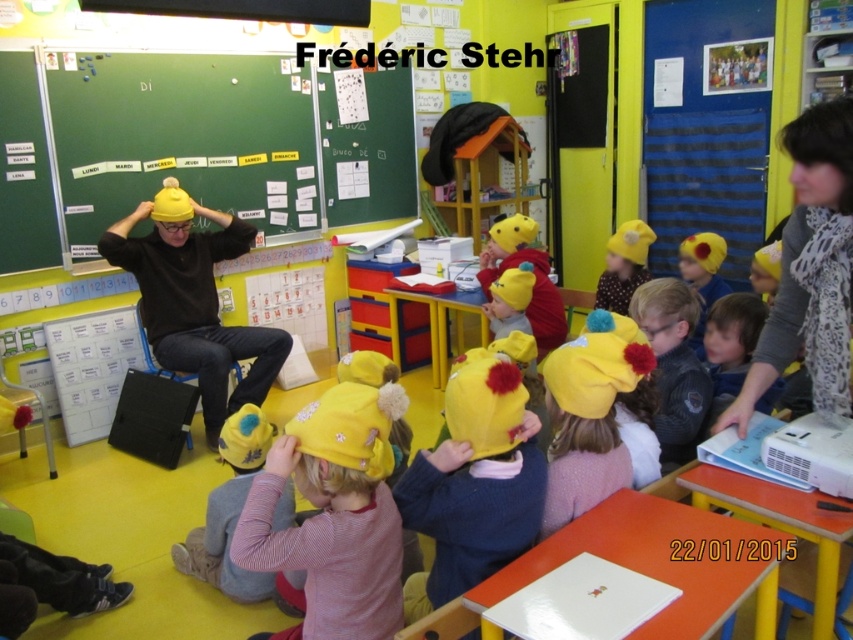
You are a photographer standing in the classroom. You want to take a closeup photo of the yellow fuzzy hat at lower center. The camera you are using has a minimum focusing distance of 1.5 meters. Can you take the photo without moving closer?

The distance between the yellow fuzzy hat at lower center and the camera is 1.57 meters, which is slightly more than the camera minimum focusing distance of 1.5 meters. Therefore, you can take the closeup photo without moving closer.

You are a student in the classroom looking at the matte yellow bulletin board at upper left and the matte yellow hat at center. Which object is nearer to you?

The matte yellow bulletin board at upper left is closer to the viewer than the matte yellow hat at center.

You are standing at the center of the classroom and want to pick up the yellow fuzzy hat at lower center. Based on its coordinates, which direction should you move to reach it?

The yellow fuzzy hat at lower center is located at coordinates point (334, 515), so you should move to the lower center direction to reach it.